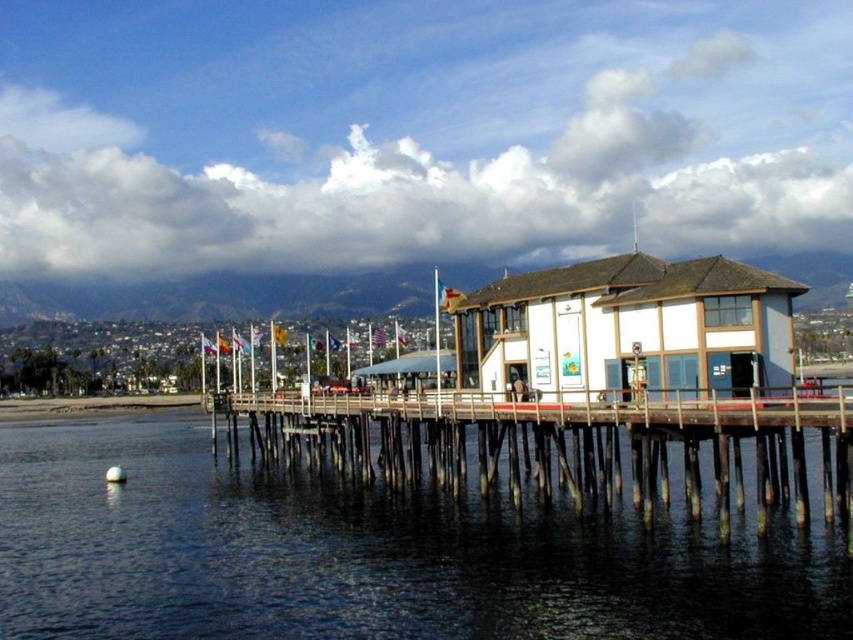
You are standing on the wooden pier and want to reach the two story building at the end. Which object, the wooden at center or the metallic flagpole at center, would you encounter first as you walk towards the building?

The wooden at center is closer to the viewer than the metallic flagpole at center, so you would encounter the wooden at center first as you walk towards the two story building.

You are standing on the wooden pier and want to take a photo of both the dark blue water at lower left and the metallic flagpole at center. Which object should you focus on first to ensure both are in the frame?

You should focus on the dark blue water at lower left first since it is closer to you than the metallic flagpole at center, ensuring both are in the frame.

You are standing on the wooden pier and want to hang a new flag on the tallest pole available. Which pole should you choose between the wooden at center and the metallic flagpole at center?

The metallic flagpole at center is taller than the wooden at center, so you should choose the metallic flagpole at center to hang the new flag.